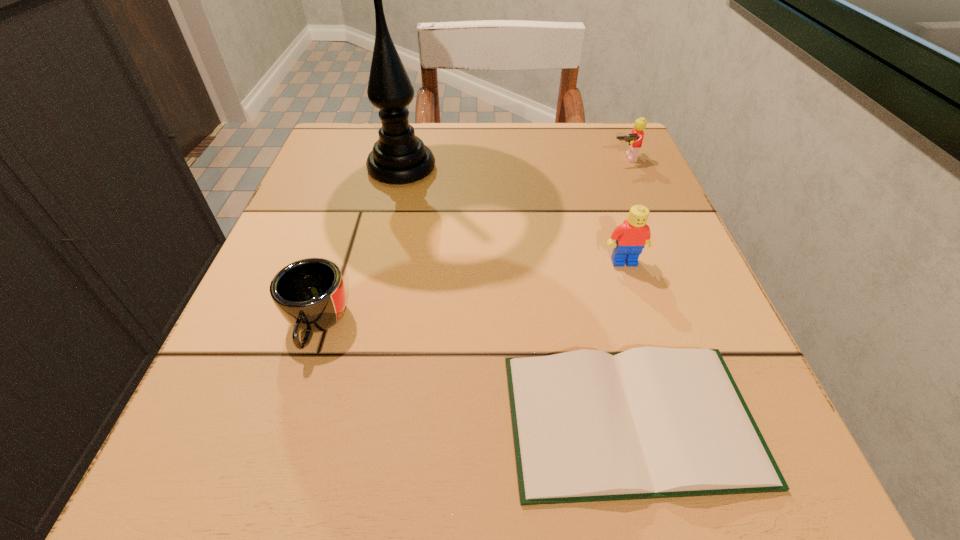
Where is `lamp`? Image resolution: width=960 pixels, height=540 pixels. lamp is located at coordinates (398, 157).

Where is `the taller Lego`? The width and height of the screenshot is (960, 540). the taller Lego is located at coordinates (631, 237).

Where is `the left Lego`? the left Lego is located at coordinates (631, 237).

Find the location of a particular element. the shorter Lego is located at coordinates (635, 139).

At what (x,y) coordinates should I click in order to perform the action: click on the third shortest object. Please return your answer as a coordinate pair (x, y). Looking at the image, I should click on coord(635,139).

Where is `the fourth tallest object`? The height and width of the screenshot is (540, 960). the fourth tallest object is located at coordinates (310, 294).

At what (x,y) coordinates should I click in order to perform the action: click on the shortest object. Please return your answer as a coordinate pair (x, y). This screenshot has width=960, height=540. Looking at the image, I should click on (651, 422).

Identify the location of free space located on the front of the lamp. (380, 261).

This screenshot has height=540, width=960. Find the location of `free point located on the face of the taller Lego`. free point located on the face of the taller Lego is located at coordinates (659, 367).

Image resolution: width=960 pixels, height=540 pixels. What are the coordinates of `vacant space situated in front of the third shortest object with the accessory visible` in the screenshot? It's located at (684, 300).